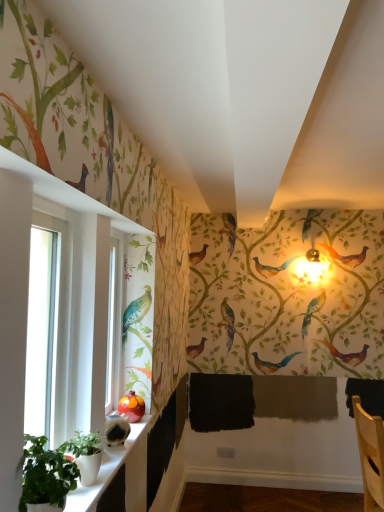
Question: Are green matte plant at lower left, which is the 2th plant from back to front, and green matte plant at lower left, acting as the second plant starting from the front, far apart?

Choices:
 (A) yes
 (B) no

Answer: (B)

Question: Can you confirm if green matte plant at lower left, acting as the 1th plant starting from the front, is smaller than green matte plant at lower left, positioned as the 1th plant in back-to-front order?

Choices:
 (A) no
 (B) yes

Answer: (A)

Question: Is green matte plant at lower left, which is the 2th plant from back to front, positioned with its back to green matte plant at lower left, positioned as the 1th plant in back-to-front order?

Choices:
 (A) no
 (B) yes

Answer: (A)

Question: Considering the relative positions of green matte plant at lower left, acting as the 1th plant starting from the front, and green matte plant at lower left, positioned as the 1th plant in back-to-front order, in the image provided, is green matte plant at lower left, acting as the 1th plant starting from the front, to the left of green matte plant at lower left, positioned as the 1th plant in back-to-front order, from the viewer's perspective?

Choices:
 (A) yes
 (B) no

Answer: (A)

Question: Does green matte plant at lower left, acting as the 1th plant starting from the front, have a lesser width compared to green matte plant at lower left, positioned as the 1th plant in back-to-front order?

Choices:
 (A) no
 (B) yes

Answer: (A)

Question: Considering the relative positions of green matte plant at lower left, which is the 2th plant from back to front, and green matte plant at lower left, positioned as the 1th plant in back-to-front order, in the image provided, is green matte plant at lower left, which is the 2th plant from back to front, behind green matte plant at lower left, positioned as the 1th plant in back-to-front order,?

Choices:
 (A) no
 (B) yes

Answer: (A)

Question: Is green matte plant at lower left, positioned as the 1th plant in back-to-front order, wider than clear glass window at left?

Choices:
 (A) yes
 (B) no

Answer: (B)

Question: From the image's perspective, is green matte plant at lower left, positioned as the 1th plant in back-to-front order, under clear glass window at left?

Choices:
 (A) no
 (B) yes

Answer: (B)

Question: Could you tell me if green matte plant at lower left, acting as the second plant starting from the front, is facing clear glass window at left?

Choices:
 (A) no
 (B) yes

Answer: (A)

Question: Is green matte plant at lower left, positioned as the 1th plant in back-to-front order, to the right of clear glass window at left from the viewer's perspective?

Choices:
 (A) no
 (B) yes

Answer: (B)

Question: Does green matte plant at lower left, positioned as the 1th plant in back-to-front order, have a lesser width compared to clear glass window at left?

Choices:
 (A) yes
 (B) no

Answer: (A)

Question: Does green matte plant at lower left, acting as the second plant starting from the front, touch clear glass window at left?

Choices:
 (A) no
 (B) yes

Answer: (A)

Question: Is clear glass window at left beside green matte plant at lower left, positioned as the 1th plant in back-to-front order?

Choices:
 (A) yes
 (B) no

Answer: (B)